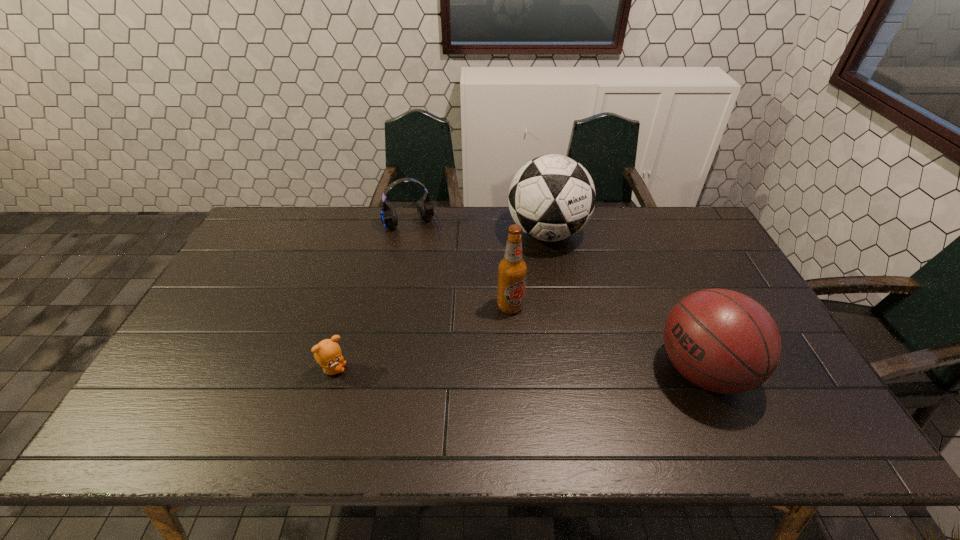
What are the coordinates of `vacant area that lies between the rightmost object and the second shortest object` in the screenshot? It's located at (558, 298).

Find the location of a particular element. free space between the rightmost object and the beer bottle is located at coordinates (607, 338).

Where is `free space between the basketball and the headset`? Image resolution: width=960 pixels, height=540 pixels. free space between the basketball and the headset is located at coordinates (558, 298).

You are a GUI agent. You are given a task and a screenshot of the screen. Output one action in this format:
    pyautogui.click(x=<x>, y=<y>)
    Task: Click on the vacant space that's between the headset and the teddy bear
    The width and height of the screenshot is (960, 540).
    Given the screenshot: What is the action you would take?
    pyautogui.click(x=373, y=298)

Locate an element on the screen. free space between the third nearest object and the teddy bear is located at coordinates click(421, 338).

You are a GUI agent. You are given a task and a screenshot of the screen. Output one action in this format:
    pyautogui.click(x=<x>, y=<y>)
    Task: Click on the vacant point located between the third nearest object and the headset
    The width and height of the screenshot is (960, 540).
    Given the screenshot: What is the action you would take?
    pyautogui.click(x=462, y=266)

Where is `free point between the soccer ball and the beer bottle`? The height and width of the screenshot is (540, 960). free point between the soccer ball and the beer bottle is located at coordinates (529, 269).

This screenshot has width=960, height=540. Identify the location of free space between the teddy bear and the second shortest object. (373, 298).

Where is `free point between the beer bottle and the soccer ball`? free point between the beer bottle and the soccer ball is located at coordinates (529, 269).

In order to click on empty space between the fourth tallest object and the soccer ball in this screenshot , I will do `click(480, 230)`.